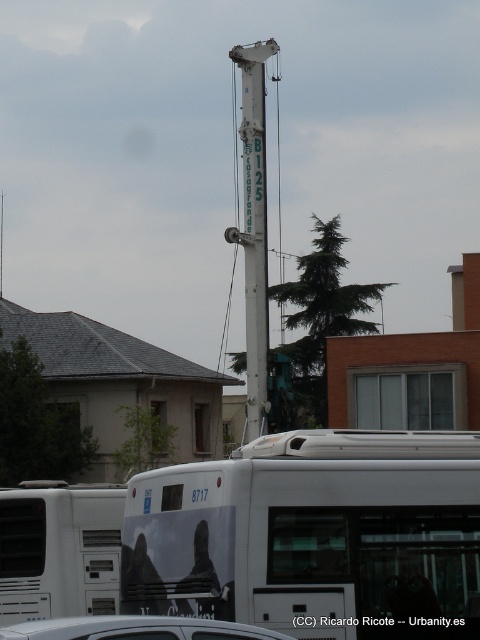
Question: Can you confirm if white painted metal pole at center is bigger than silver metallic car at lower center?

Choices:
 (A) yes
 (B) no

Answer: (A)

Question: Which object is positioned farthest from the white painted metal pole at center?

Choices:
 (A) silver metallic car at lower center
 (B) white matte bus at center

Answer: (A)

Question: Which point appears closest to the camera in this image?

Choices:
 (A) (241, 131)
 (B) (205, 625)

Answer: (B)

Question: Which point appears farthest from the camera in this image?

Choices:
 (A) (36, 636)
 (B) (254, 225)

Answer: (B)

Question: Can you confirm if white painted metal pole at center is positioned above silver metallic car at lower center?

Choices:
 (A) no
 (B) yes

Answer: (B)

Question: Does white matte bus at center appear over silver metallic car at lower center?

Choices:
 (A) yes
 (B) no

Answer: (A)